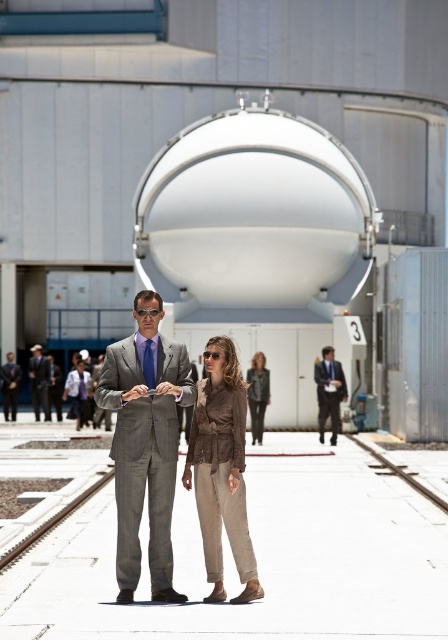
What do you see at coordinates (145, 444) in the screenshot? I see `gray wool suit at center` at bounding box center [145, 444].

Is gray wool suit at center above gray metallic train track at lower left?

Correct, gray wool suit at center is located above gray metallic train track at lower left.

This screenshot has height=640, width=448. In order to click on gray wool suit at center in this screenshot , I will do `click(145, 444)`.

Is point (156, 572) farther from viewer compared to point (203, 552)?

That is False.

What do you see at coordinates (145, 444) in the screenshot? I see `gray wool suit at center` at bounding box center [145, 444].

Where is `gray wool suit at center`? The image size is (448, 640). gray wool suit at center is located at coordinates (145, 444).

Does leather jacket at center have a lesser height compared to gray suit at center?

Indeed, leather jacket at center has a lesser height compared to gray suit at center.

Is leather jacket at center further to the viewer compared to gray suit at center?

No, leather jacket at center is closer to the viewer.

This screenshot has height=640, width=448. I want to click on leather jacket at center, so click(x=258, y=394).